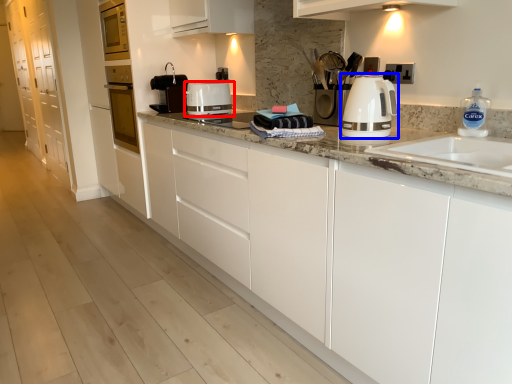
Question: Which of the following is the farthest to the observer, kitchen appliance (highlighted by a red box) or home appliance (highlighted by a blue box)?

Choices:
 (A) kitchen appliance
 (B) home appliance

Answer: (A)